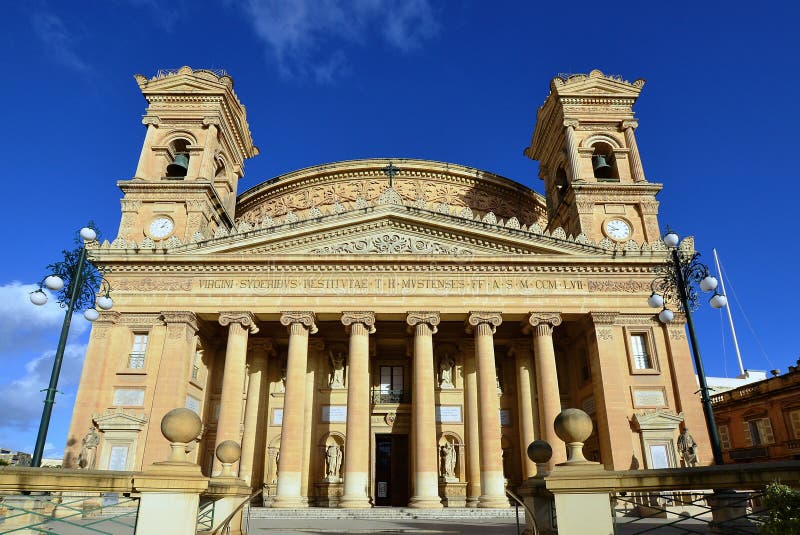
Find the location of `clocks`. clocks is located at coordinates coord(610,221), coord(162,224).